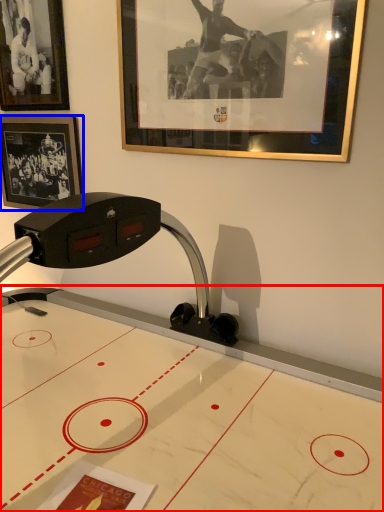
Question: Which of the following is the closest to the observer, table (highlighted by a red box) or picture frame (highlighted by a blue box)?

Choices:
 (A) table
 (B) picture frame

Answer: (A)